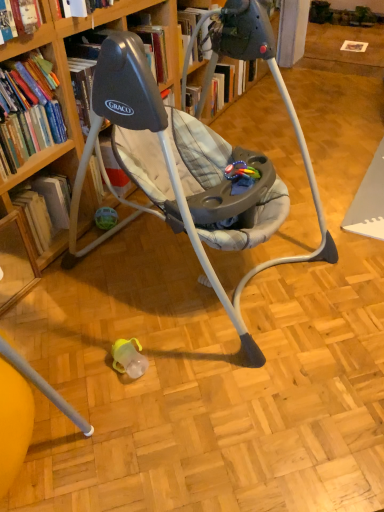
Question: Can you confirm if hardcover book at left, placed as the first book when sorted from top to bottom, is thinner than hardcover book at left, which is the first book in bottom-to-top order?

Choices:
 (A) no
 (B) yes

Answer: (B)

Question: Does hardcover book at left, placed as the first book when sorted from top to bottom, have a lesser height compared to hardcover book at left, which is the first book in bottom-to-top order?

Choices:
 (A) no
 (B) yes

Answer: (A)

Question: Can you confirm if hardcover book at left, placed as the first book when sorted from top to bottom, is bigger than hardcover book at left, positioned as the 2th book in top-to-bottom order?

Choices:
 (A) no
 (B) yes

Answer: (B)

Question: Would you say hardcover book at left, placed as the first book when sorted from top to bottom, is outside hardcover book at left, positioned as the 2th book in top-to-bottom order?

Choices:
 (A) yes
 (B) no

Answer: (A)

Question: From the image's perspective, is hardcover book at left, placed as the first book when sorted from top to bottom, over hardcover book at left, which is the first book in bottom-to-top order?

Choices:
 (A) yes
 (B) no

Answer: (A)

Question: Is wooden bookcase at upper left taller or shorter than hardcover book at left, positioned as the 2th book in top-to-bottom order?

Choices:
 (A) short
 (B) tall

Answer: (B)

Question: Considering the positions of wooden bookcase at upper left and hardcover book at left, which is the first book in bottom-to-top order, in the image, is wooden bookcase at upper left bigger or smaller than hardcover book at left, which is the first book in bottom-to-top order,?

Choices:
 (A) big
 (B) small

Answer: (A)

Question: Considering the positions of wooden bookcase at upper left and hardcover book at left, positioned as the 2th book in top-to-bottom order, in the image, is wooden bookcase at upper left wider or thinner than hardcover book at left, positioned as the 2th book in top-to-bottom order,?

Choices:
 (A) thin
 (B) wide

Answer: (B)

Question: From the image's perspective, relative to hardcover book at left, positioned as the 2th book in top-to-bottom order, is wooden bookcase at upper left above or below?

Choices:
 (A) above
 (B) below

Answer: (A)

Question: From a real-world perspective, is wooden bookcase at upper left positioned above or below hardcover book at left, which is counted as the 2th book, starting from the bottom?

Choices:
 (A) below
 (B) above

Answer: (A)

Question: Which is correct: wooden bookcase at upper left is inside hardcover book at left, placed as the first book when sorted from top to bottom, or outside of it?

Choices:
 (A) inside
 (B) outside

Answer: (B)

Question: From the image's perspective, is wooden bookcase at upper left positioned above or below hardcover book at left, placed as the first book when sorted from top to bottom?

Choices:
 (A) below
 (B) above

Answer: (A)

Question: Is wooden bookcase at upper left bigger or smaller than hardcover book at left, which is counted as the 2th book, starting from the bottom?

Choices:
 (A) small
 (B) big

Answer: (B)

Question: Choose the correct answer: Is hardcover book at left, which is the first book in bottom-to-top order, inside wooden bookcase at upper left or outside it?

Choices:
 (A) outside
 (B) inside

Answer: (A)

Question: Considering their positions, is hardcover book at left, which is the first book in bottom-to-top order, located in front of or behind wooden bookcase at upper left?

Choices:
 (A) behind
 (B) front

Answer: (A)